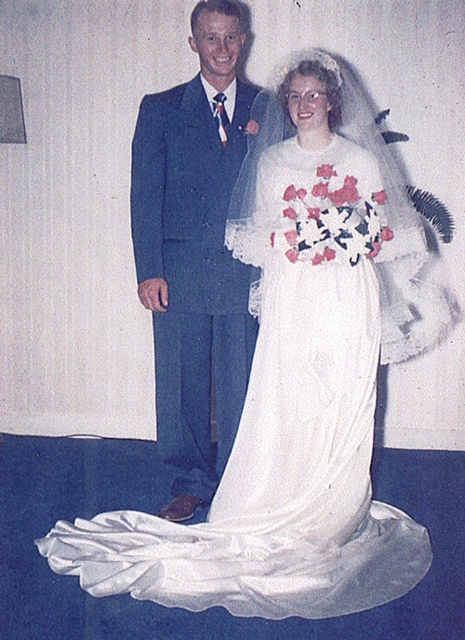
Is point (367, 179) closer to viewer compared to point (204, 339)?

Yes, point (367, 179) is closer to viewer.

Does white satin dress at center have a lesser width compared to blue wool suit at center?

No.

Who is more forward, [330,506] or [211,384]?

Point [330,506]

At what (x,y) coordinates should I click in order to perform the action: click on white satin dress at center. Please return your answer as a coordinate pair (x, y). The width and height of the screenshot is (465, 640). Looking at the image, I should click on (285, 428).